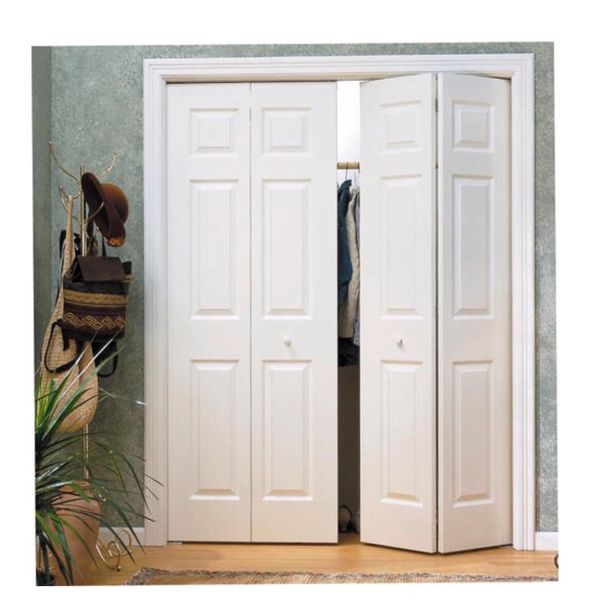
Where is `rug`? rug is located at coordinates (208, 583).